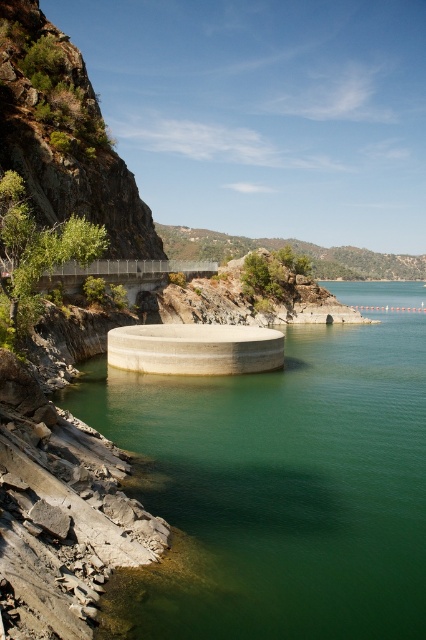
Question: Which point appears closest to the camera in this image?

Choices:
 (A) (123, 337)
 (B) (120, 417)

Answer: (B)

Question: Can you confirm if concrete cylinder at center is positioned above gray concrete cylinder at center?

Choices:
 (A) yes
 (B) no

Answer: (B)

Question: Is concrete cylinder at center to the left of gray concrete cylinder at center from the viewer's perspective?

Choices:
 (A) yes
 (B) no

Answer: (B)

Question: Is concrete cylinder at center positioned in front of gray concrete cylinder at center?

Choices:
 (A) yes
 (B) no

Answer: (A)

Question: Among these objects, which one is nearest to the camera?

Choices:
 (A) gray concrete cylinder at center
 (B) concrete cylinder at center

Answer: (B)